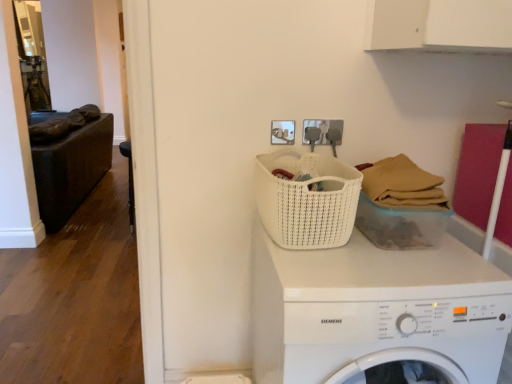
The width and height of the screenshot is (512, 384). What are the coordinates of `space that is in front of white woven basket at center, placed as the first basket when sorted from left to right` in the screenshot? It's located at (345, 276).